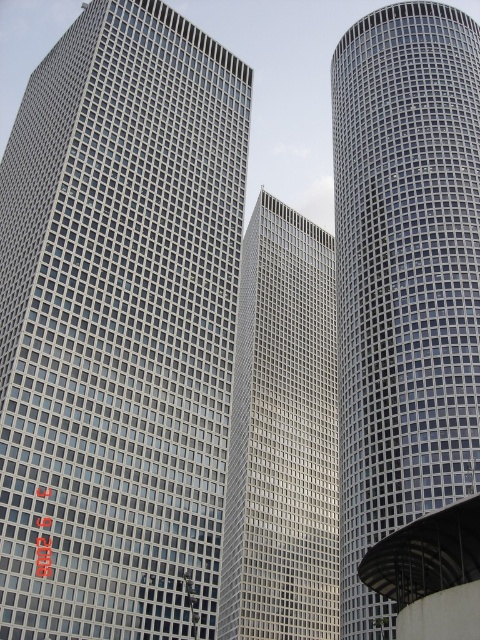
You are standing at the base of the tallest building on the left and want to walk towards the cylindrical building on the right. There are two points marked on your path. Which point, point (x=384, y=24) or point (x=331, y=582), will you encounter first?

You will encounter point (x=331, y=582) first because point (x=384, y=24) is behind it along the path towards the cylindrical building on the right.

You are standing at the center of the image. Which direction should you face to look directly at the metallic grid tower at center?

Since you are already at the center of the image, facing the metallic grid tower at center would require looking straight ahead as it is positioned at the central point of the scene.